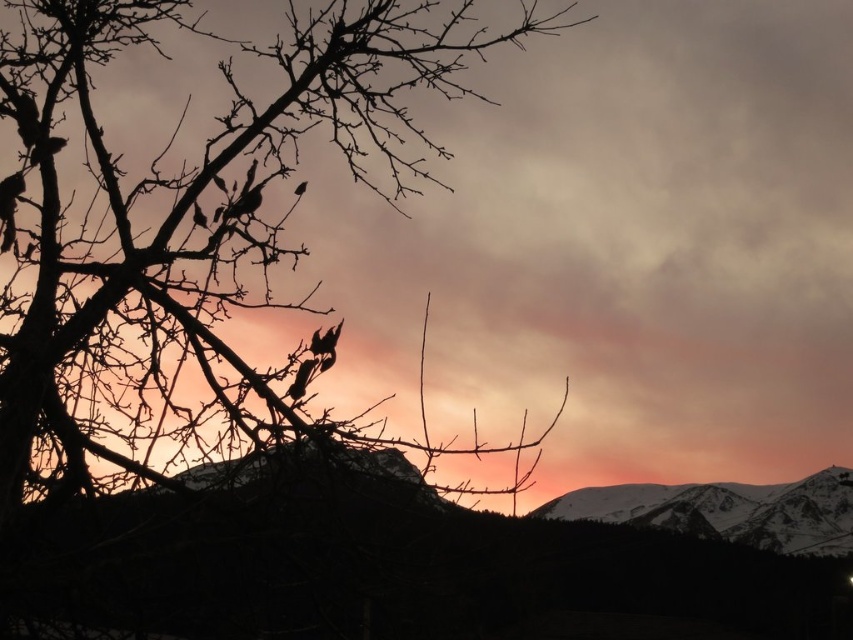
Question: Which object appears closest to the camera in this image?

Choices:
 (A) snowy rocky mountain at lower right
 (B) silhouette branches at left

Answer: (B)

Question: Which of the following is the farthest from the observer?

Choices:
 (A) silhouette branches at left
 (B) snowy rocky mountain at lower right

Answer: (B)

Question: In this image, where is silhouette branches at left located relative to snowy rocky mountain at lower right?

Choices:
 (A) below
 (B) above

Answer: (B)

Question: Which point is closer to the camera?

Choices:
 (A) (637, 509)
 (B) (251, 444)

Answer: (B)

Question: Can you confirm if silhouette branches at left is smaller than snowy rocky mountain at lower right?

Choices:
 (A) no
 (B) yes

Answer: (A)

Question: Is silhouette branches at left positioned in front of snowy rocky mountain at lower right?

Choices:
 (A) yes
 (B) no

Answer: (A)